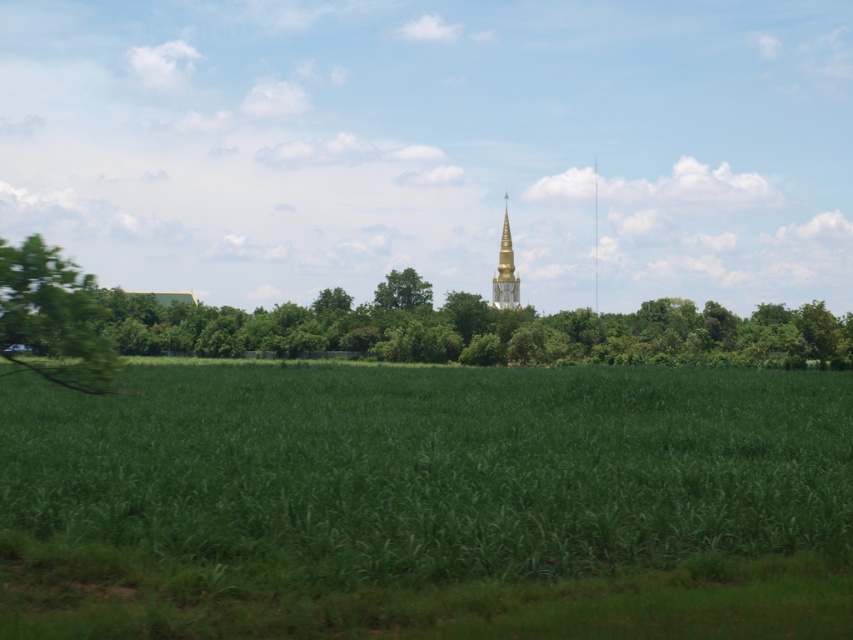
Question: Among these points, which one is nearest to the camera?

Choices:
 (A) (503, 195)
 (B) (33, 272)
 (C) (613, 369)

Answer: (B)

Question: Is green leafy tree at left to the right of gold metallic spire at center from the viewer's perspective?

Choices:
 (A) no
 (B) yes

Answer: (A)

Question: Can you confirm if green leafy tree at left is wider than gold metallic spire at center?

Choices:
 (A) yes
 (B) no

Answer: (A)

Question: Which point is farther to the camera?

Choices:
 (A) gold metallic spire at center
 (B) green leafy tree at left
 (C) green grass at center

Answer: (A)

Question: Estimate the real-world distances between objects in this image. Which object is closer to the green leafy tree at left?

Choices:
 (A) green grass at center
 (B) gold metallic spire at center

Answer: (A)

Question: Is green grass at center positioned at the back of gold metallic spire at center?

Choices:
 (A) yes
 (B) no

Answer: (B)